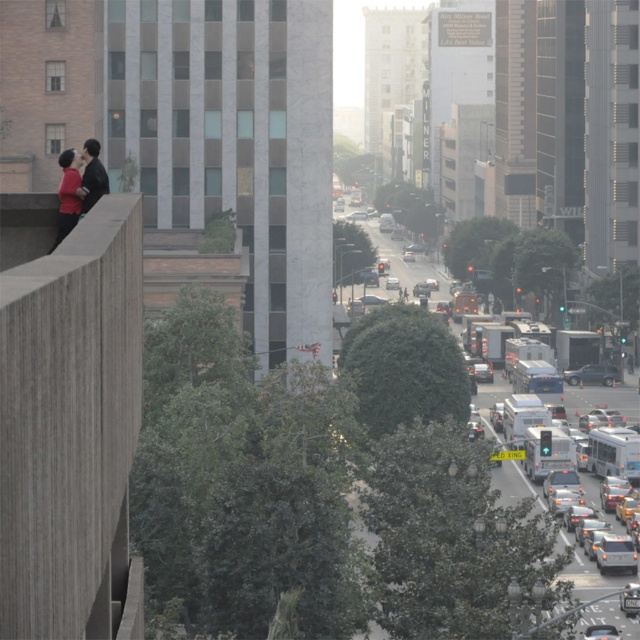
You are a delivery person trying to locate the shiny silver sedan at lower right in the busy city scene. From your vantage point near the matte black couple at left, in which direction should you look to find the car?

The shiny silver sedan at lower right is located below the matte black couple at left, so you should look downward or towards the lower part of the scene to find the car.

You are a city planner assessing the urban layout. Given the presence of the metallic silver bus at center and the matte black couple at left, which object occupies a higher vertical position in the scene?

The metallic silver bus at center is much taller than the matte black couple at left, so it occupies a higher vertical position.